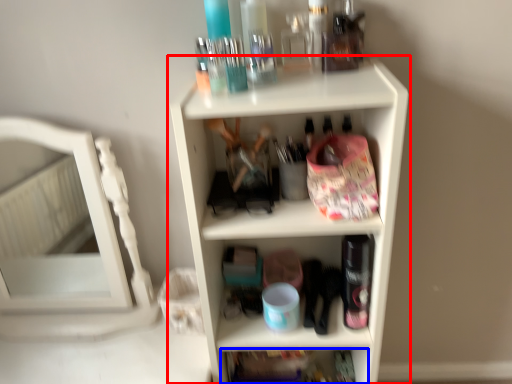
Question: Which object appears farthest to the camera in this image, shelf (highlighted by a red box) or shelf (highlighted by a blue box)?

Choices:
 (A) shelf
 (B) shelf

Answer: (B)